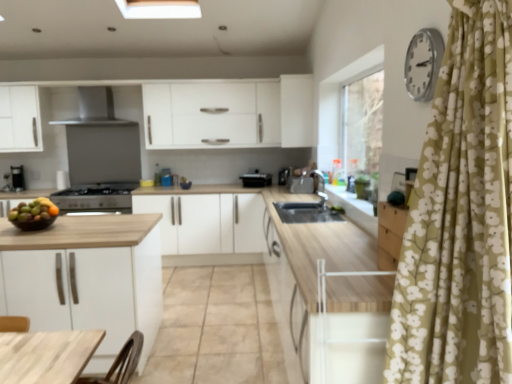
Question: From a real-world perspective, is white matte cabinet at upper center, marked as the 2th cabinetry in a bottom-to-top arrangement, physically above black plastic toaster at center, marked as the 2th appliance in a right-to-left arrangement?

Choices:
 (A) no
 (B) yes

Answer: (B)

Question: Does white matte cabinet at upper center, acting as the 2th cabinetry starting from the left, appear on the right side of black plastic toaster at center, marked as the second appliance in a left-to-right arrangement?

Choices:
 (A) no
 (B) yes

Answer: (B)

Question: Considering the relative sizes of white matte cabinet at upper center, which is the first cabinetry from right to left, and black plastic toaster at center, marked as the 2th appliance in a right-to-left arrangement, in the image provided, is white matte cabinet at upper center, which is the first cabinetry from right to left, thinner than black plastic toaster at center, marked as the 2th appliance in a right-to-left arrangement,?

Choices:
 (A) yes
 (B) no

Answer: (A)

Question: Is black plastic toaster at center, marked as the second appliance in a left-to-right arrangement, at the back of white matte cabinet at upper center, the first cabinetry positioned from the top?

Choices:
 (A) yes
 (B) no

Answer: (B)

Question: Would you say black plastic toaster at center, marked as the second appliance in a left-to-right arrangement, is part of white matte cabinet at upper center, acting as the 2th cabinetry starting from the left,'s contents?

Choices:
 (A) no
 (B) yes

Answer: (A)

Question: From their relative heights in the image, would you say stainless steel range hood at upper center is taller or shorter than satin silver sink at center, placed as the 1th appliance when sorted from right to left?

Choices:
 (A) short
 (B) tall

Answer: (B)

Question: Does point (87, 109) appear closer or farther from the camera than point (298, 178)?

Choices:
 (A) closer
 (B) farther

Answer: (B)

Question: Considering the relative positions of stainless steel range hood at upper center and satin silver sink at center, placed as the 1th appliance when sorted from right to left, in the image provided, is stainless steel range hood at upper center to the left or to the right of satin silver sink at center, placed as the 1th appliance when sorted from right to left,?

Choices:
 (A) right
 (B) left

Answer: (B)

Question: Looking at their shapes, would you say stainless steel range hood at upper center is wider or thinner than satin silver sink at center, positioned as the 3th appliance in left-to-right order?

Choices:
 (A) thin
 (B) wide

Answer: (B)

Question: From a real-world perspective, is white matte cabinet at upper center, the first cabinetry positioned from the top, positioned above or below black matte gas stove at center-left, which appears as the 1th appliance when viewed from the left?

Choices:
 (A) below
 (B) above

Answer: (B)

Question: Is white matte cabinet at upper center, which is the first cabinetry from right to left, bigger or smaller than black matte gas stove at center-left, the third appliance viewed from the right?

Choices:
 (A) small
 (B) big

Answer: (B)

Question: In terms of height, does white matte cabinet at upper center, the first cabinetry positioned from the top, look taller or shorter compared to black matte gas stove at center-left, which appears as the 1th appliance when viewed from the left?

Choices:
 (A) tall
 (B) short

Answer: (A)

Question: Is white matte cabinet at upper center, which is the first cabinetry from right to left, inside the boundaries of black matte gas stove at center-left, which appears as the 1th appliance when viewed from the left, or outside?

Choices:
 (A) outside
 (B) inside

Answer: (A)

Question: Is silver metallic clock at upper right situated inside white matte cabinet at center, which appears as the second cabinetry when viewed from the right, or outside?

Choices:
 (A) inside
 (B) outside

Answer: (B)

Question: From a real-world perspective, is silver metallic clock at upper right above or below white matte cabinet at center, which is the second cabinetry in top-to-bottom order?

Choices:
 (A) above
 (B) below

Answer: (A)